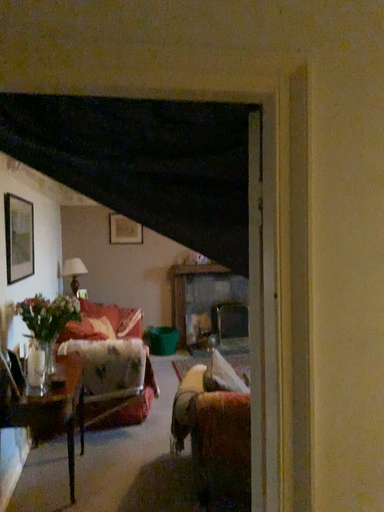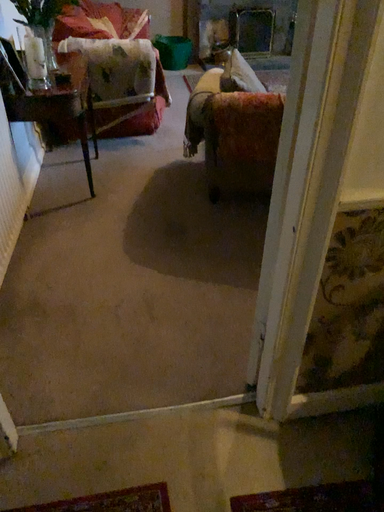
Question: How did the camera likely rotate when shooting the video?

Choices:
 (A) rotated downward
 (B) rotated upward

Answer: (A)